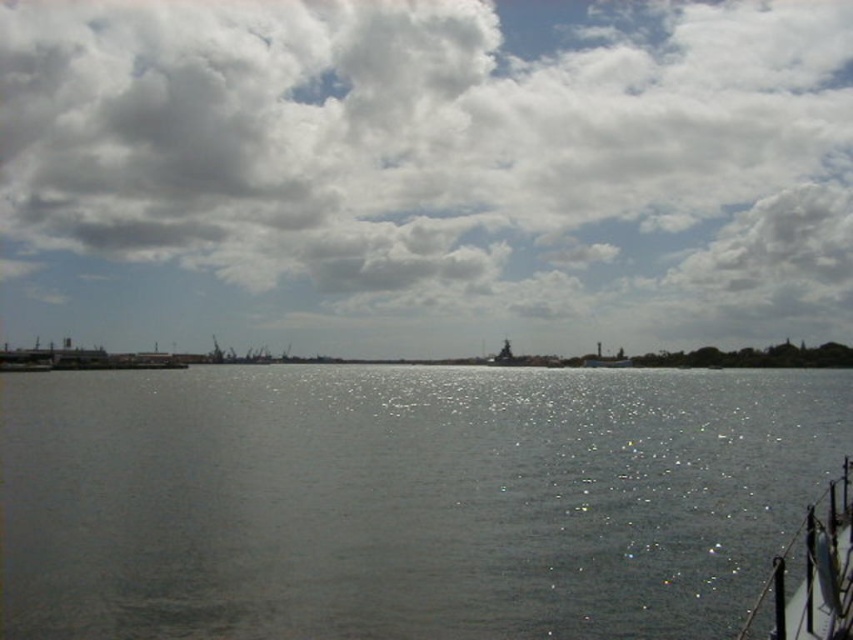
Question: Which object is the farthest from the gray water at center?

Choices:
 (A) white fluffy cloud at upper center
 (B) metallic gray boat at lower right

Answer: (A)

Question: In this image, where is white fluffy cloud at upper center located relative to metallic gray boat at lower right?

Choices:
 (A) right
 (B) left

Answer: (B)

Question: Which of the following is the farthest from the observer?

Choices:
 (A) metallic gray boat at lower right
 (B) white fluffy cloud at upper center

Answer: (B)

Question: Estimate the real-world distances between objects in this image. Which object is closer to the metallic gray boat at lower right?

Choices:
 (A) gray water at center
 (B) metallic gray ship at center

Answer: (A)

Question: Can you confirm if white fluffy cloud at upper center is wider than gray water at center?

Choices:
 (A) yes
 (B) no

Answer: (A)

Question: Where is gray water at center located in relation to metallic gray boat at lower right in the image?

Choices:
 (A) left
 (B) right

Answer: (A)